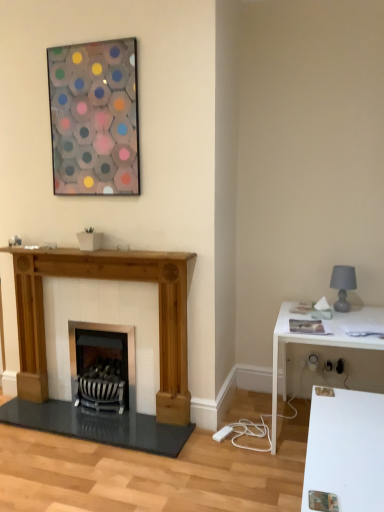
Question: Is gray matte lampshade at right at the right side of translucent glass hexagon at upper center?

Choices:
 (A) yes
 (B) no

Answer: (A)

Question: Is gray matte lampshade at right positioned before translucent glass hexagon at upper center?

Choices:
 (A) yes
 (B) no

Answer: (B)

Question: Is gray matte lampshade at right aimed at translucent glass hexagon at upper center?

Choices:
 (A) yes
 (B) no

Answer: (B)

Question: Is gray matte lampshade at right to the left of translucent glass hexagon at upper center from the viewer's perspective?

Choices:
 (A) no
 (B) yes

Answer: (A)

Question: Is gray matte lampshade at right shorter than translucent glass hexagon at upper center?

Choices:
 (A) yes
 (B) no

Answer: (A)

Question: Considering the relative sizes of gray matte lampshade at right and translucent glass hexagon at upper center in the image provided, is gray matte lampshade at right taller than translucent glass hexagon at upper center?

Choices:
 (A) no
 (B) yes

Answer: (A)

Question: Would you say black striped wood burning stove at center contains gray matte lampshade at right?

Choices:
 (A) yes
 (B) no

Answer: (B)

Question: Is black striped wood burning stove at center further to the viewer compared to gray matte lampshade at right?

Choices:
 (A) no
 (B) yes

Answer: (B)

Question: Considering the relative sizes of black striped wood burning stove at center and gray matte lampshade at right in the image provided, is black striped wood burning stove at center smaller than gray matte lampshade at right?

Choices:
 (A) yes
 (B) no

Answer: (B)

Question: From the image's perspective, is black striped wood burning stove at center on gray matte lampshade at right?

Choices:
 (A) no
 (B) yes

Answer: (A)

Question: Is black striped wood burning stove at center wider than gray matte lampshade at right?

Choices:
 (A) no
 (B) yes

Answer: (B)

Question: From the image's perspective, is black striped wood burning stove at center located beneath gray matte lampshade at right?

Choices:
 (A) yes
 (B) no

Answer: (A)

Question: Is white glossy table at right next to natural wood fireplace at left?

Choices:
 (A) no
 (B) yes

Answer: (A)